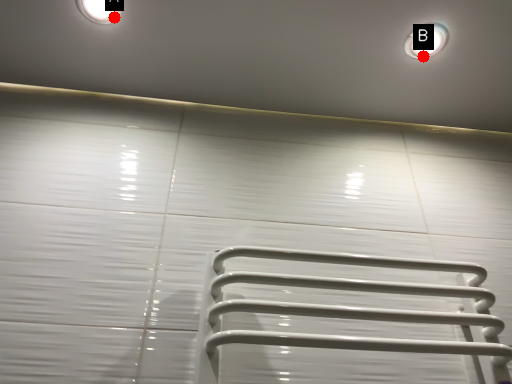
Question: Two points are circled on the image, labeled by A and B beside each circle. Among these points, which one is nearest to the camera?

Choices:
 (A) A is closer
 (B) B is closer

Answer: (A)